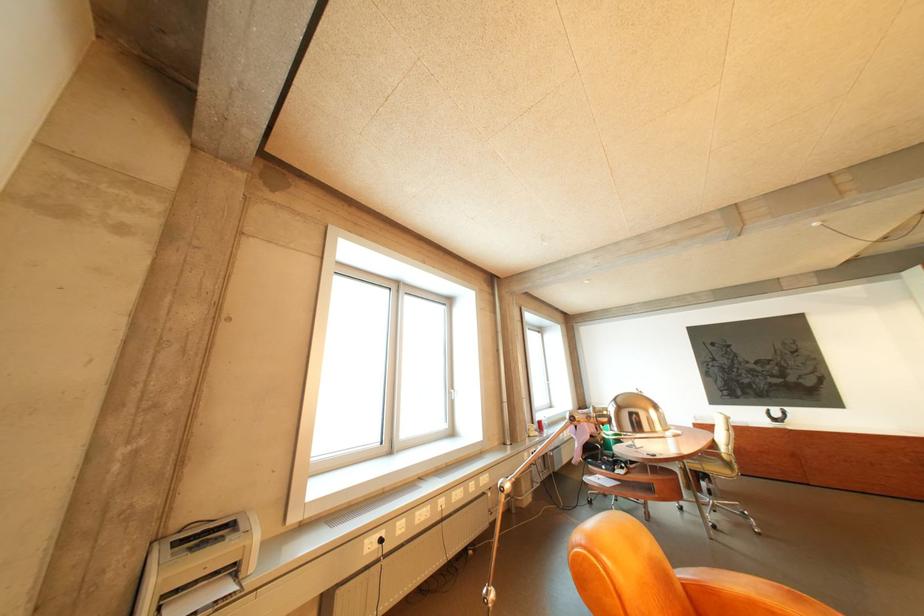
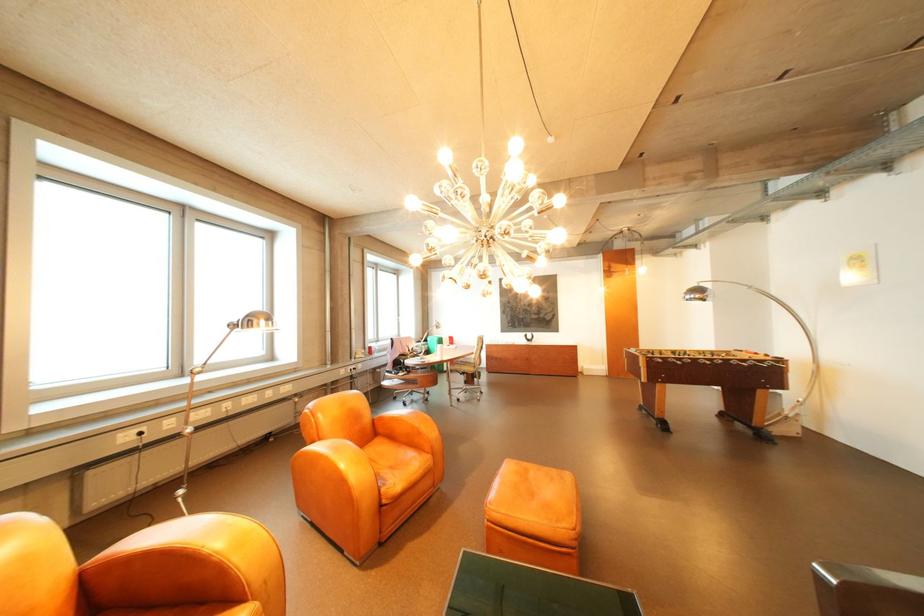
The point at (643, 415) is marked in the first image. Where is the corresponding point in the second image?

(262, 322)